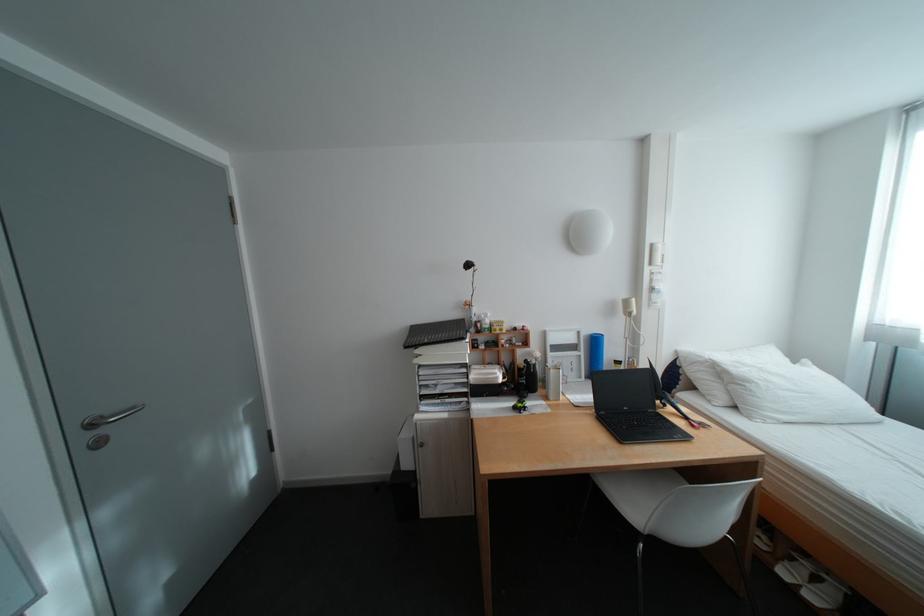
This screenshot has height=616, width=924. I want to click on intercom handset, so click(x=525, y=383).